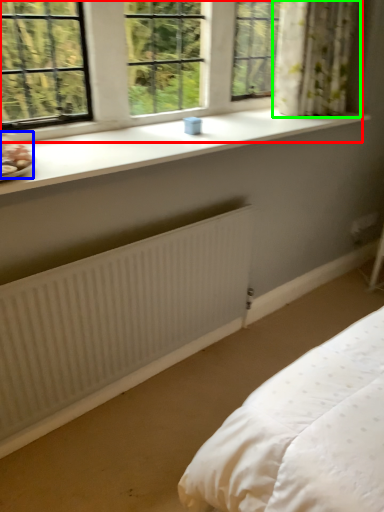
Question: Based on their relative distances, which object is farther from window (highlighted by a red box)? Choose from food (highlighted by a blue box) and curtain (highlighted by a green box).

Choices:
 (A) food
 (B) curtain

Answer: (B)